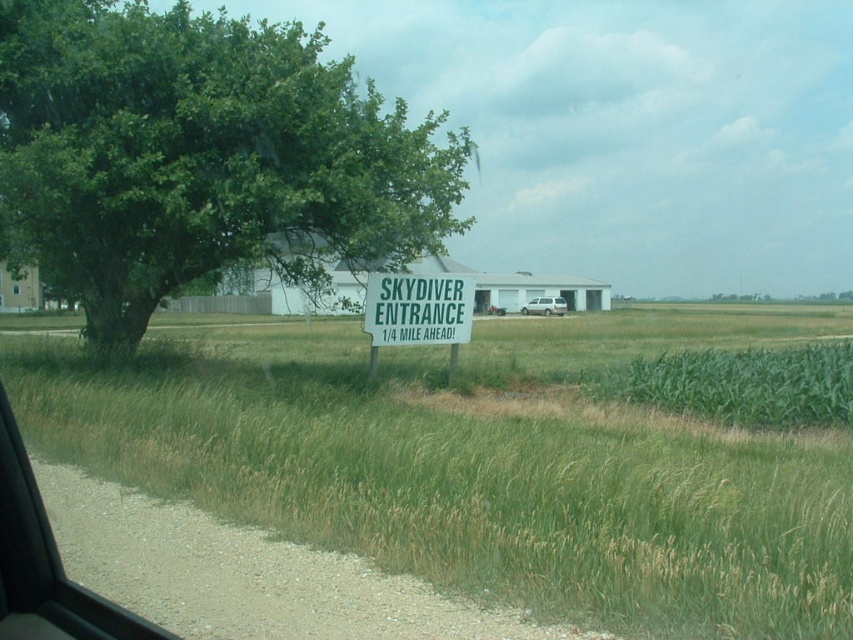
You are driving and want to read the white plastic sign at center. Can you see the entire text on the sign through the transparent glass car window at lower left?

The transparent glass car window at lower left has a lesser height compared to white plastic sign at center, so you cannot see the entire text on the white plastic sign at center through the window because the window is shorter than the sign.